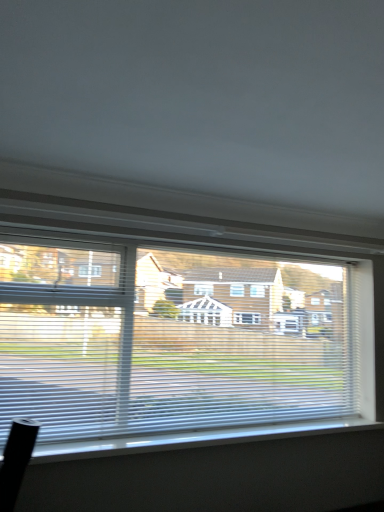
Based on the photo, measure the distance between white plastic blinds at lower center and camera.

The distance of white plastic blinds at lower center from camera is 32.50 inches.

In order to click on white plastic blinds at lower center in this screenshot , I will do `click(202, 95)`.

In order to face white plastic blinds at lower center, should I rotate leftwards or rightwards?

A 16.962 degree turn to the right will do.

What do you see at coordinates (202, 95) in the screenshot? The image size is (384, 512). I see `white plastic blinds at lower center` at bounding box center [202, 95].

The width and height of the screenshot is (384, 512). In order to click on white plastic blinds at lower center in this screenshot , I will do (202, 95).